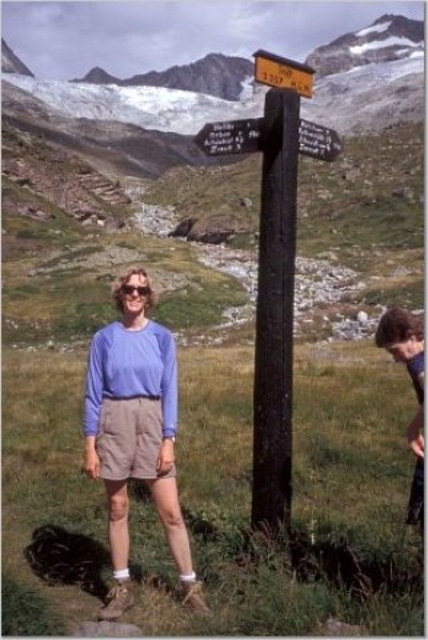
Which is in front, point (220, 132) or point (281, 74)?

Point (281, 74) is more forward.

What do you see at coordinates (231, 136) in the screenshot? I see `wooden post at center` at bounding box center [231, 136].

Which is in front, point (321, 156) or point (312, 74)?

Point (321, 156) is more forward.

Locate an element on the screen. The width and height of the screenshot is (428, 640). wooden post at center is located at coordinates (231, 136).

Is point (115, 378) farther from viewer compared to point (262, 77)?

Yes.

In the scene shown: Can you confirm if matte blue shirt at center is shorter than yellow wooden signpost at center?

Indeed, matte blue shirt at center has a lesser height compared to yellow wooden signpost at center.

Which is behind, point (146, 337) or point (291, 67)?

The point (146, 337) is more distant.

Identify the location of matte blue shirt at center. Image resolution: width=428 pixels, height=640 pixels. pyautogui.click(x=134, y=429).

The height and width of the screenshot is (640, 428). Find the location of `dark brown wood post at center`. dark brown wood post at center is located at coordinates (275, 310).

Between dark brown wood post at center and wooden post at center, which one appears on the right side from the viewer's perspective?

wooden post at center

Who is more distant from viewer, (291, 392) or (312, 152)?

The point (291, 392) is more distant.

Locate an element on the screen. dark brown wood post at center is located at coordinates (275, 310).